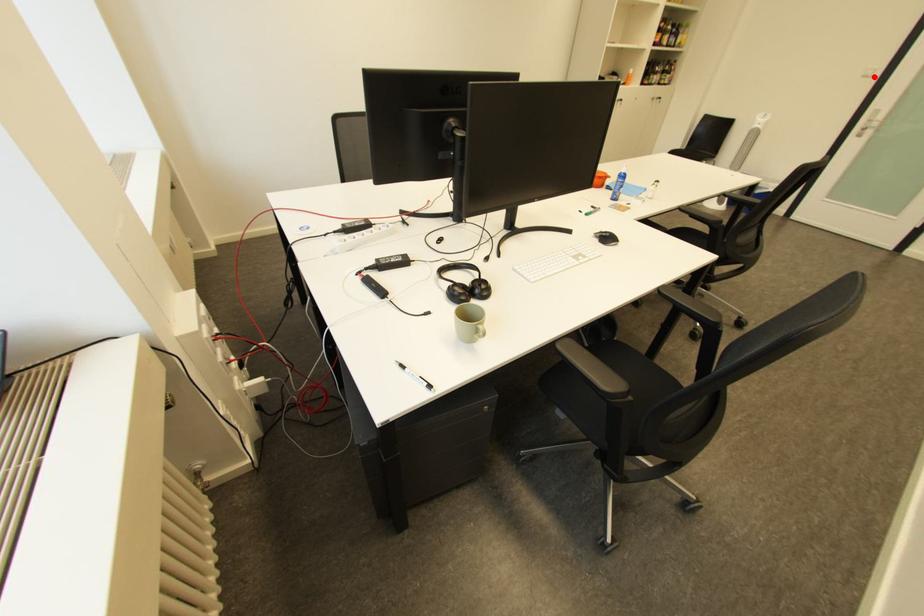
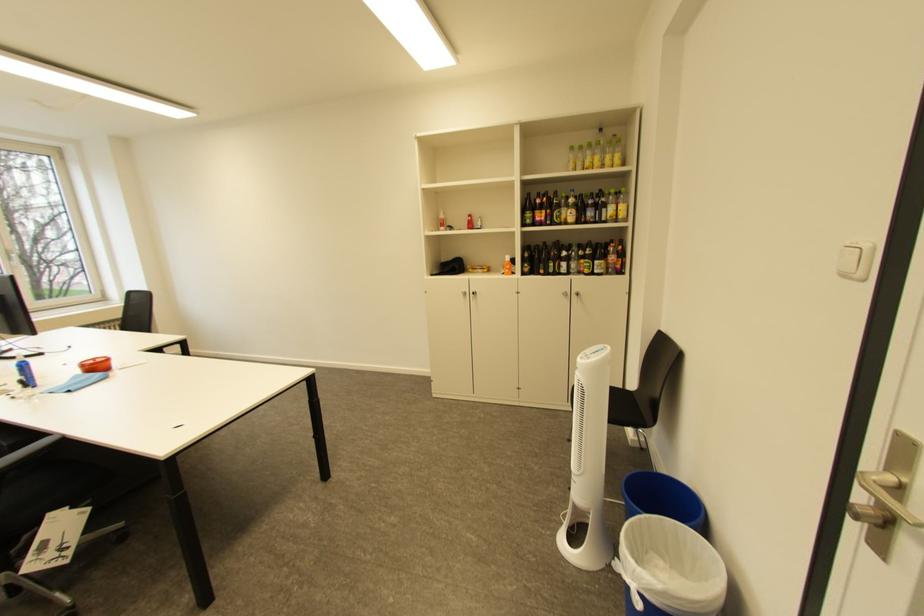
Question: I am providing you with two images of the same scene from different viewpoints. Image1 has a red point marked. In image2, the corresponding 3D location appears at what relative position? Reply with the corresponding letter.

Choices:
 (A) Closer
 (B) Farther

Answer: (A)